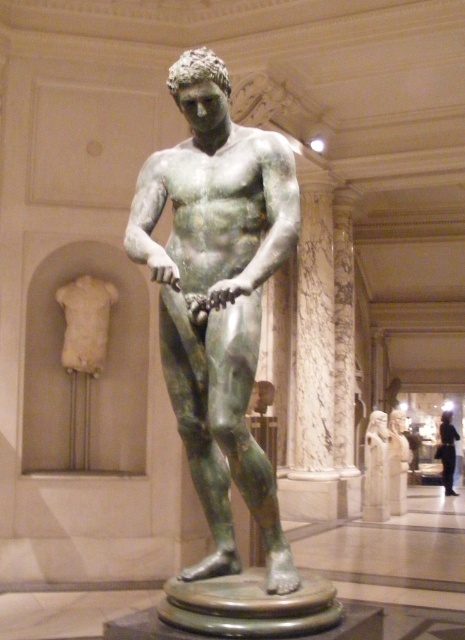
Locate an element on the screen. green patinated bronze statue at center is located at coordinates (219, 296).

Is green patinated bronze statue at center positioned in front of bronze statue at center?

That is True.

Where is `green patinated bronze statue at center`? The width and height of the screenshot is (465, 640). green patinated bronze statue at center is located at coordinates (219, 296).

Identify the location of green patinated bronze statue at center. This screenshot has height=640, width=465. (219, 296).